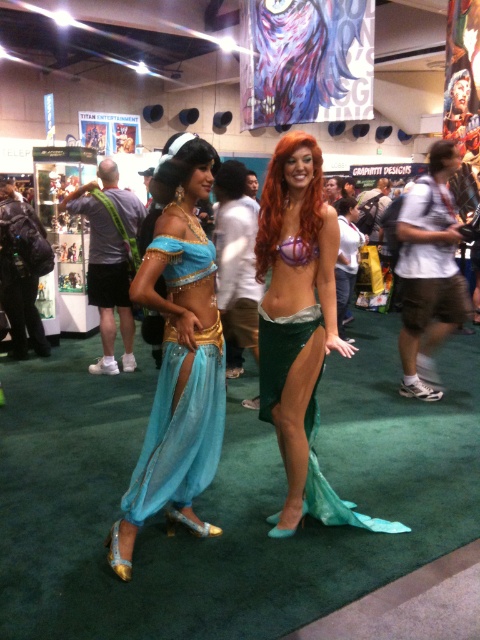
Question: Is matte blue fabric dress at center smaller than shiny green tail at center?

Choices:
 (A) no
 (B) yes

Answer: (B)

Question: Does matte blue fabric dress at center come in front of shiny green tail at center?

Choices:
 (A) no
 (B) yes

Answer: (B)

Question: Among these objects, which one is nearest to the camera?

Choices:
 (A) shiny green tail at center
 (B) matte blue fabric dress at center

Answer: (B)

Question: Which object appears closest to the camera in this image?

Choices:
 (A) matte blue fabric dress at center
 (B) shiny green tail at center

Answer: (A)

Question: Is matte blue fabric dress at center to the left of shiny green tail at center from the viewer's perspective?

Choices:
 (A) no
 (B) yes

Answer: (B)